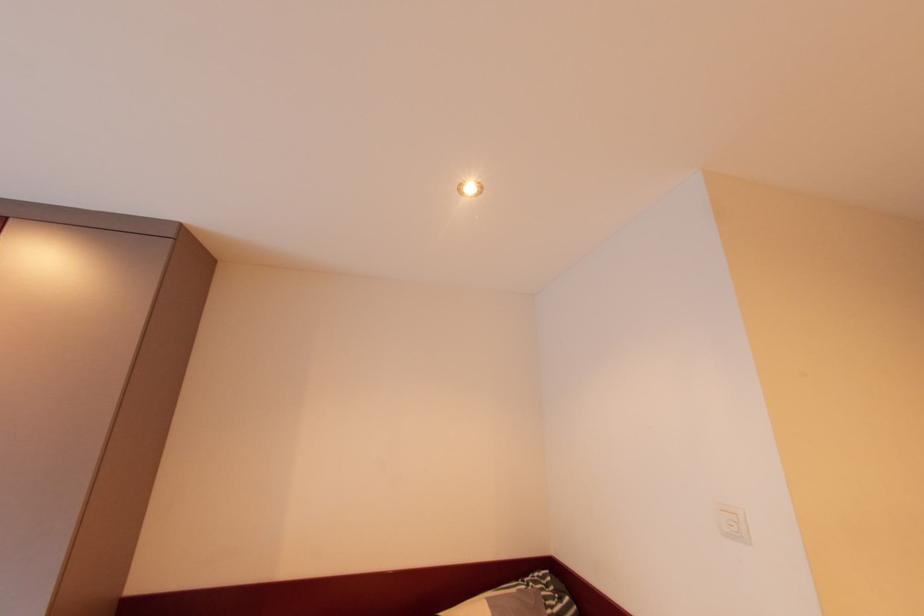
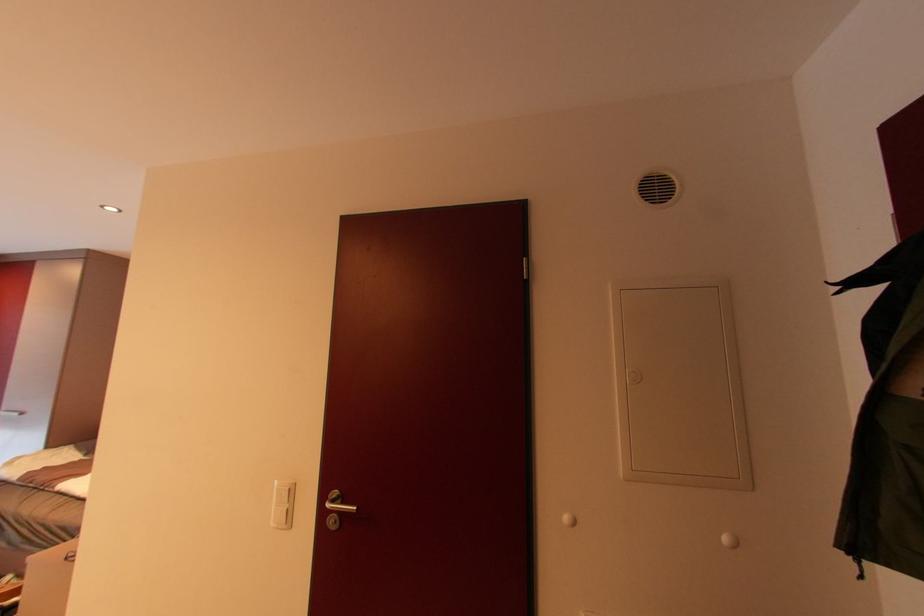
Question: The images are taken continuously from a first-person perspective. In which direction are you moving?

Choices:
 (A) Left
 (B) Right
 (C) Forward
 (D) Backward

Answer: (B)